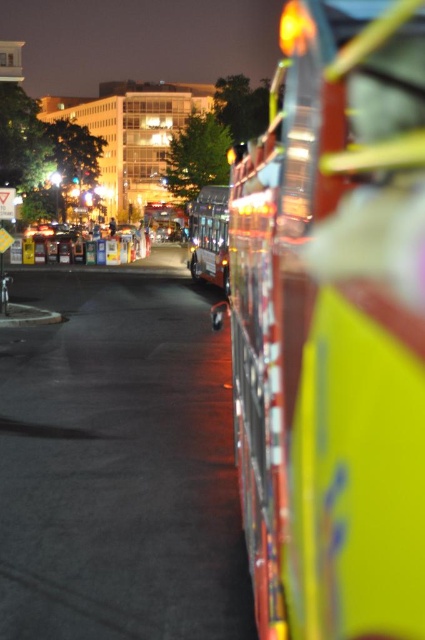
Which is in front, point (394, 467) or point (197, 280)?

Point (394, 467)

Does metallic silver fire truck at right have a lesser height compared to metallic silver bus at center?

Indeed, metallic silver fire truck at right has a lesser height compared to metallic silver bus at center.

Where is `metallic silver fire truck at right`? This screenshot has height=640, width=425. metallic silver fire truck at right is located at coordinates (329, 333).

Identify the location of metallic silver fire truck at right. This screenshot has width=425, height=640. (329, 333).